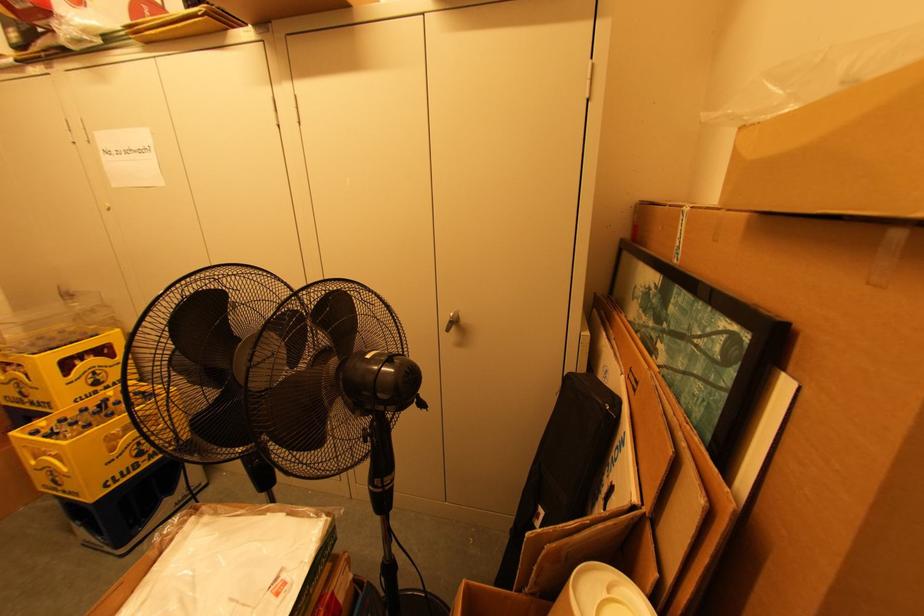
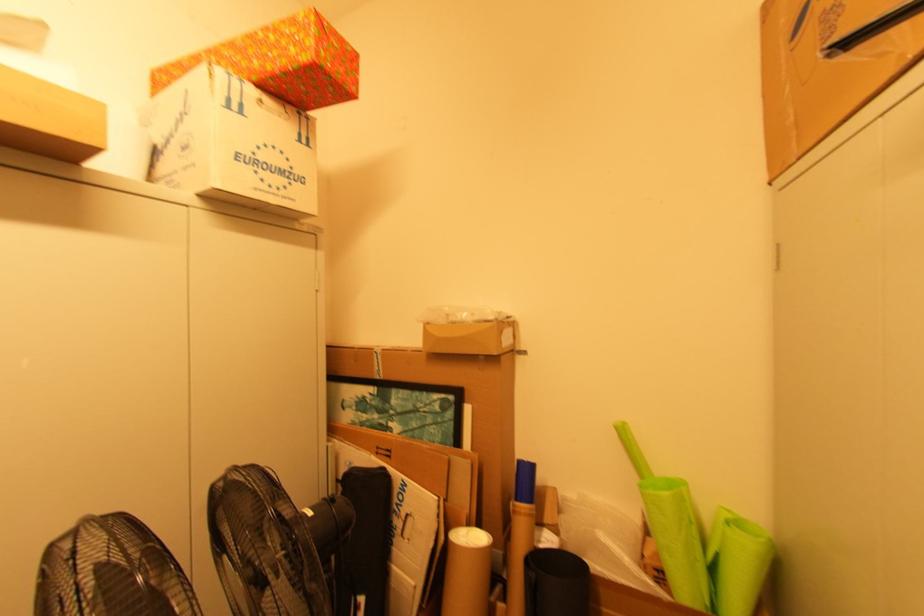
Question: Based on the continuous images, in which direction is the camera rotating? Reply with the corresponding letter.

Choices:
 (A) Left
 (B) Right
 (C) Up
 (D) Down

Answer: (B)